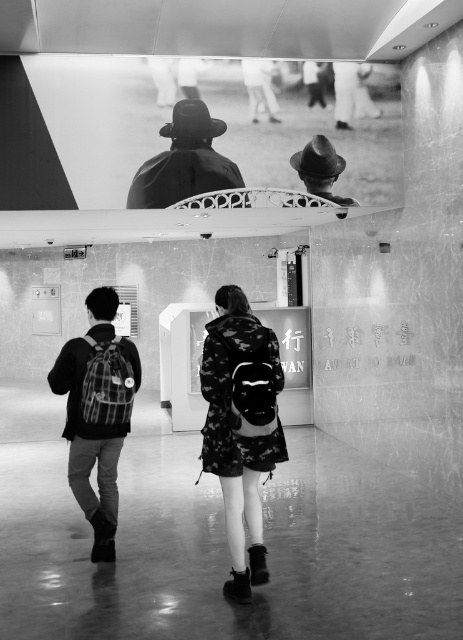
The height and width of the screenshot is (640, 463). Find the location of `camo-patterned backpack at center`. camo-patterned backpack at center is located at coordinates (241, 428).

Between point (267, 580) and point (166, 129), which one is positioned in front?

Positioned in front is point (267, 580).

The width and height of the screenshot is (463, 640). In order to click on camo-patterned backpack at center in this screenshot , I will do `click(241, 428)`.

Does camouflage-patterned backpack at center have a smaller size compared to camo-patterned backpack at center?

Correct, camouflage-patterned backpack at center occupies less space than camo-patterned backpack at center.

Who is taller, camouflage-patterned backpack at center or camo-patterned backpack at center?

camo-patterned backpack at center is taller.

Is point (213, 390) farther from viewer compared to point (239, 337)?

No, (213, 390) is closer to viewer.

At what (x,y) coordinates should I click in order to perform the action: click on camouflage-patterned backpack at center. Please return your answer as a coordinate pair (x, y). The width and height of the screenshot is (463, 640). Looking at the image, I should click on (241, 428).

Is camo-patterned backpack at center smaller than plaid fabric backpack at left?

Yes.

Who is more distant from viewer, (262, 416) or (111, 314)?

Positioned behind is point (111, 314).

Between point (200, 369) and point (87, 454), which one is positioned in front?

Point (200, 369)

What are the coordinates of `camo-patterned backpack at center` in the screenshot? It's located at (241, 428).